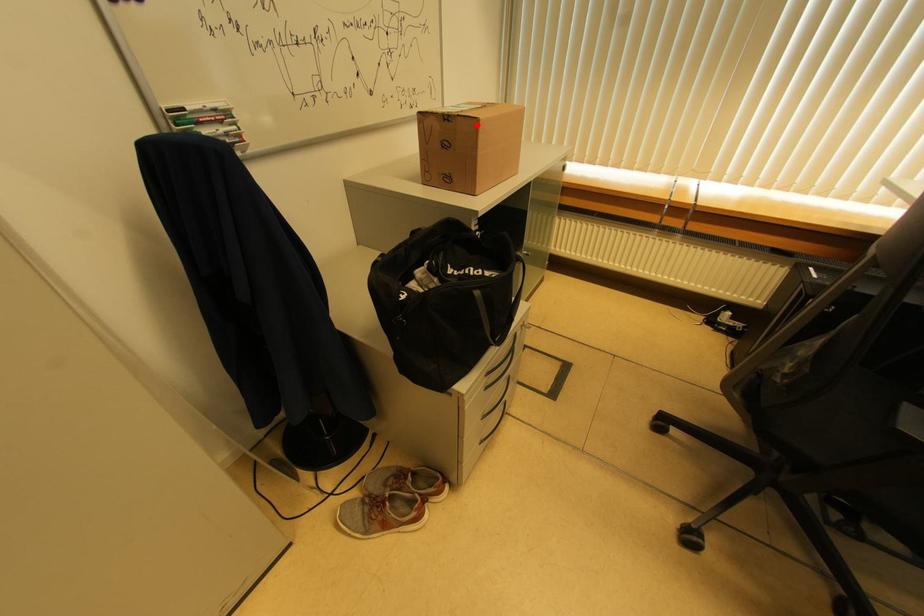
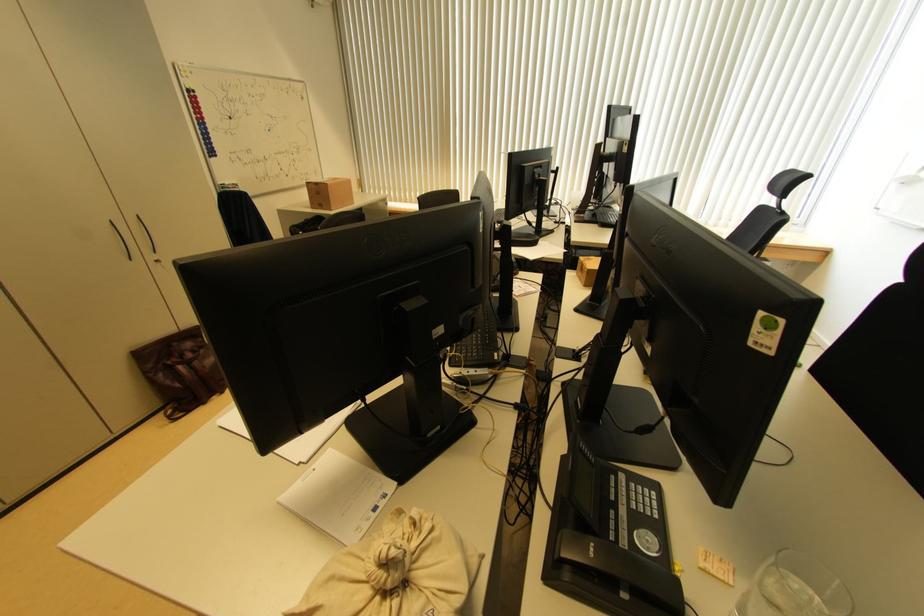
Question: I am providing you with two images of the same scene from different viewpoints. Given a red point in image1, look at the same physical point in image2. Is it:

Choices:
 (A) Closer to the viewpoint
 (B) Farther from the viewpoint

Answer: (A)